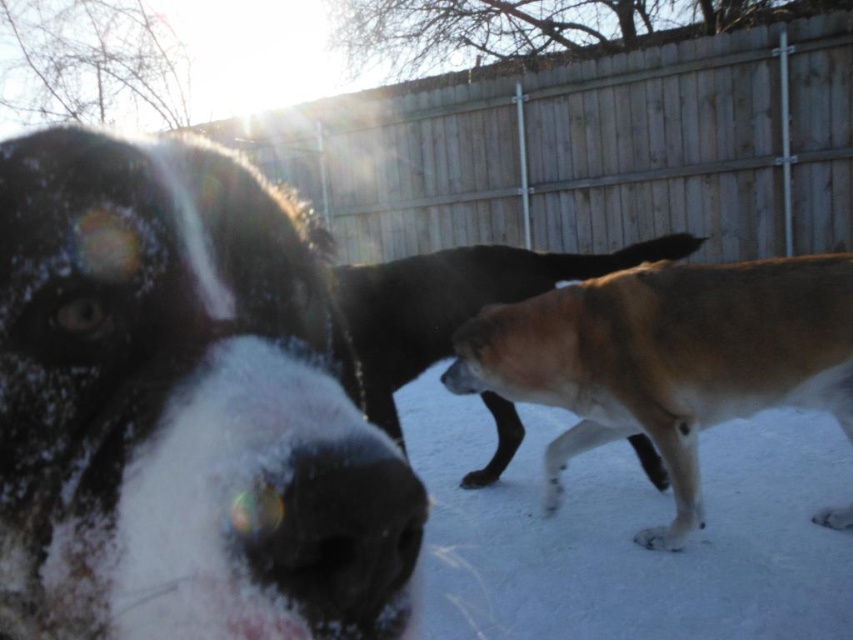
Who is shorter, wooden fence at center or brown fur dog at center?

brown fur dog at center

Who is positioned more to the left, wooden fence at center or brown fur dog at center?

wooden fence at center

Is point (730, 88) closer to camera compared to point (337, 298)?

No.

Identify the location of wooden fence at center. This screenshot has width=853, height=640. (585, 150).

Does brown furry dog at center have a lesser height compared to brown fur dog at center?

In fact, brown furry dog at center may be taller than brown fur dog at center.

Between point (737, 328) and point (415, 362), which one is positioned behind?

The point (415, 362) is more distant.

Does point (746, 294) come in front of point (402, 264)?

Yes, it is.

I want to click on brown furry dog at center, so click(x=668, y=358).

Looking at this image, does white fur dog at center appear on the left side of black matte nose at center?

Yes, white fur dog at center is to the left of black matte nose at center.

Can you confirm if white fur dog at center is bigger than black matte nose at center?

Yes, white fur dog at center is bigger than black matte nose at center.

I want to click on white fur dog at center, so click(180, 408).

Find the location of a particular element. This screenshot has height=640, width=853. white fur dog at center is located at coordinates (180, 408).